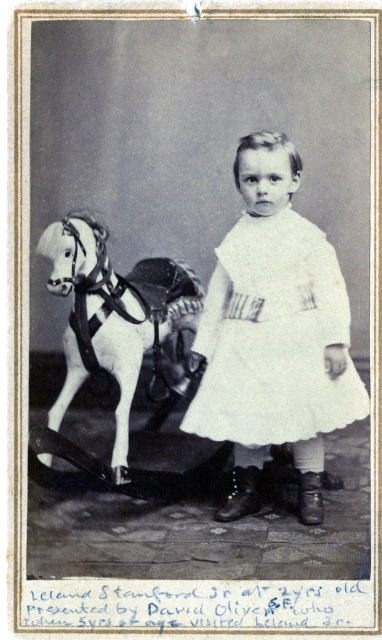
Is white cotton dress at center smaller than white matte wooden horse at left?

Indeed, white cotton dress at center has a smaller size compared to white matte wooden horse at left.

Who is lower down, white cotton dress at center or white matte wooden horse at left?

white matte wooden horse at left is lower down.

The image size is (382, 640). Describe the element at coordinates (273, 337) in the screenshot. I see `white cotton dress at center` at that location.

At what (x,y) coordinates should I click in order to perform the action: click on white cotton dress at center. Please return your answer as a coordinate pair (x, y). The image size is (382, 640). Looking at the image, I should click on (273, 337).